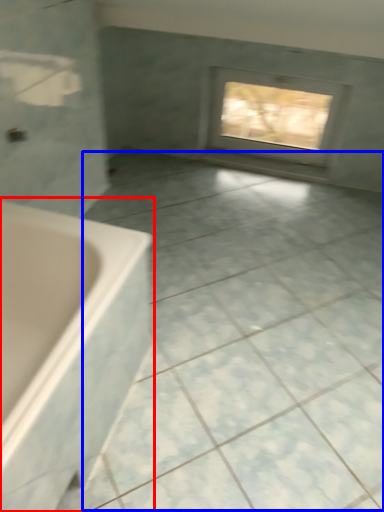
Question: Among these objects, which one is farthest to the camera, bathtub (highlighted by a red box) or ceramic tile (highlighted by a blue box)?

Choices:
 (A) bathtub
 (B) ceramic tile

Answer: (B)